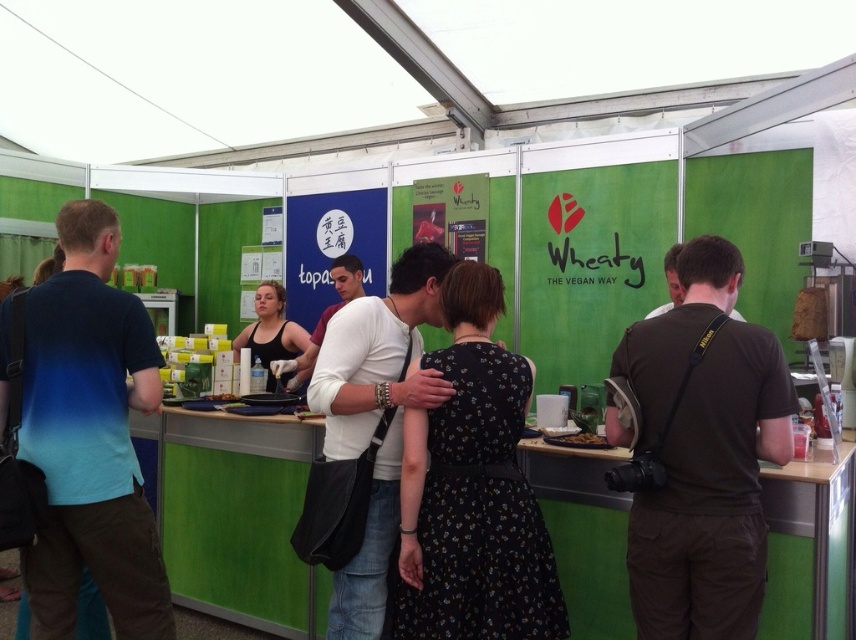
Who is positioned more to the right, blue gradient t-shirt at left or black fabric tank top at center?

From the viewer's perspective, black fabric tank top at center appears more on the right side.

Does blue gradient t-shirt at left appear under black fabric tank top at center?

Yes, blue gradient t-shirt at left is below black fabric tank top at center.

Which is behind, point (99, 465) or point (284, 372)?

Point (284, 372)

Locate an element on the screen. This screenshot has height=640, width=856. blue gradient t-shirt at left is located at coordinates pyautogui.click(x=90, y=436).

Between blue gradient t-shirt at left and brown crumbly at center, which one has less height?

brown crumbly at center

Can you confirm if blue gradient t-shirt at left is bigger than brown crumbly at center?

Yes.

This screenshot has width=856, height=640. What do you see at coordinates (90, 436) in the screenshot? I see `blue gradient t-shirt at left` at bounding box center [90, 436].

This screenshot has width=856, height=640. Identify the location of blue gradient t-shirt at left. (90, 436).

Which of these two, brown fabric camera at right or black floral dress at center, stands taller?

Standing taller between the two is brown fabric camera at right.

Can you confirm if brown fabric camera at right is positioned above black floral dress at center?

Correct, brown fabric camera at right is located above black floral dress at center.

Who is more forward, (718, 497) or (501, 355)?

Point (718, 497) is more forward.

Locate an element on the screen. brown fabric camera at right is located at coordinates 703,454.